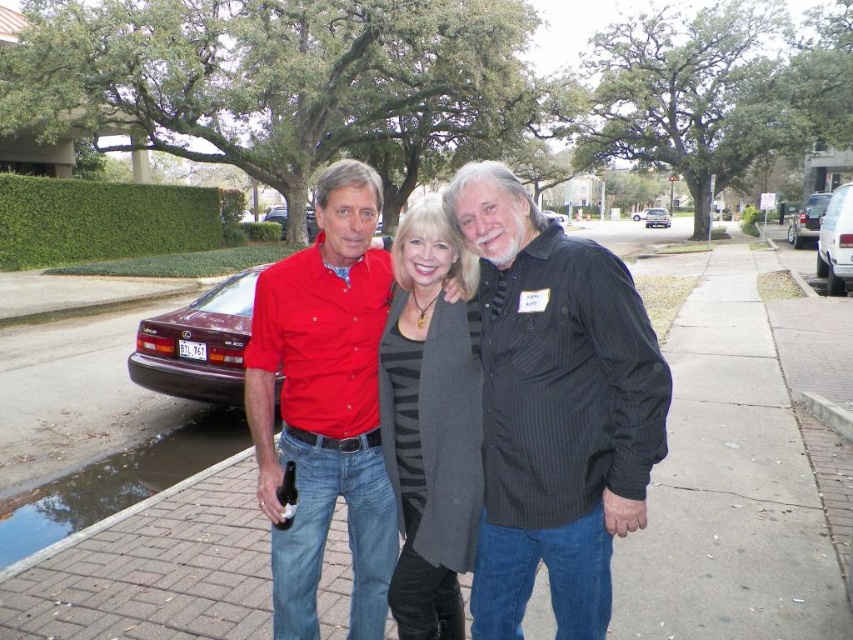
From the picture: You are a delivery person trying to deliver a package to the woman wearing the gray wool cardigan at center. There is a maroon metallic sedan at center blocking the path. Can you estimate whether the space between the sedan and the cardigan is wide enough to pass through?

The gray wool cardigan at center has a lesser width compared to the maroon metallic sedan at center, so the space between them might be narrow. However, since the sedan is a vehicle and the cardigan is clothing on a person, their positions might not be directly adjacent. Without exact distance details, it is uncertain if the space is wide enough for passage.

You are a delivery person trying to deliver a package to the woman in the gray wool cardigan at center. The package can only be placed on the trunk of the maroon metallic sedan at center. Can you place the package directly between the two objects?

The gray wool cardigan at center is to the left of the maroon metallic sedan at center, so placing the package directly between them would require positioning it between the woman wearing the cardigan and the sedan.